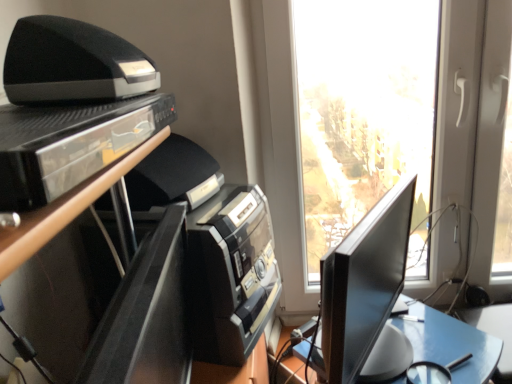
Question: From the image's perspective, is black glossy shelf at upper left beneath black glossy monitor at right?

Choices:
 (A) yes
 (B) no

Answer: (B)

Question: Is black glossy shelf at upper left in contact with black glossy monitor at right?

Choices:
 (A) yes
 (B) no

Answer: (B)

Question: Could you tell me if black glossy shelf at upper left is facing black glossy monitor at right?

Choices:
 (A) no
 (B) yes

Answer: (A)

Question: Is black glossy shelf at upper left taller than black glossy monitor at right?

Choices:
 (A) no
 (B) yes

Answer: (A)

Question: From the image's perspective, does black glossy shelf at upper left appear higher than black glossy monitor at right?

Choices:
 (A) yes
 (B) no

Answer: (A)

Question: Can you confirm if black glossy shelf at upper left is smaller than black glossy monitor at right?

Choices:
 (A) no
 (B) yes

Answer: (B)

Question: Is black glossy shelf at upper left positioned in front of black glossy entertainment center at left?

Choices:
 (A) yes
 (B) no

Answer: (A)

Question: Considering the relative positions of black glossy shelf at upper left and black glossy entertainment center at left in the image provided, is black glossy shelf at upper left to the left of black glossy entertainment center at left from the viewer's perspective?

Choices:
 (A) yes
 (B) no

Answer: (A)

Question: Can you confirm if black glossy shelf at upper left is thinner than black glossy entertainment center at left?

Choices:
 (A) yes
 (B) no

Answer: (A)

Question: Are black glossy shelf at upper left and black glossy entertainment center at left far apart?

Choices:
 (A) no
 (B) yes

Answer: (A)

Question: Can you confirm if black glossy shelf at upper left is positioned to the right of black glossy entertainment center at left?

Choices:
 (A) yes
 (B) no

Answer: (B)

Question: Is black glossy shelf at upper left completely or partially outside of black glossy entertainment center at left?

Choices:
 (A) no
 (B) yes

Answer: (B)

Question: Is black glossy monitor at right positioned with its back to black glossy shelf at upper left?

Choices:
 (A) yes
 (B) no

Answer: (B)